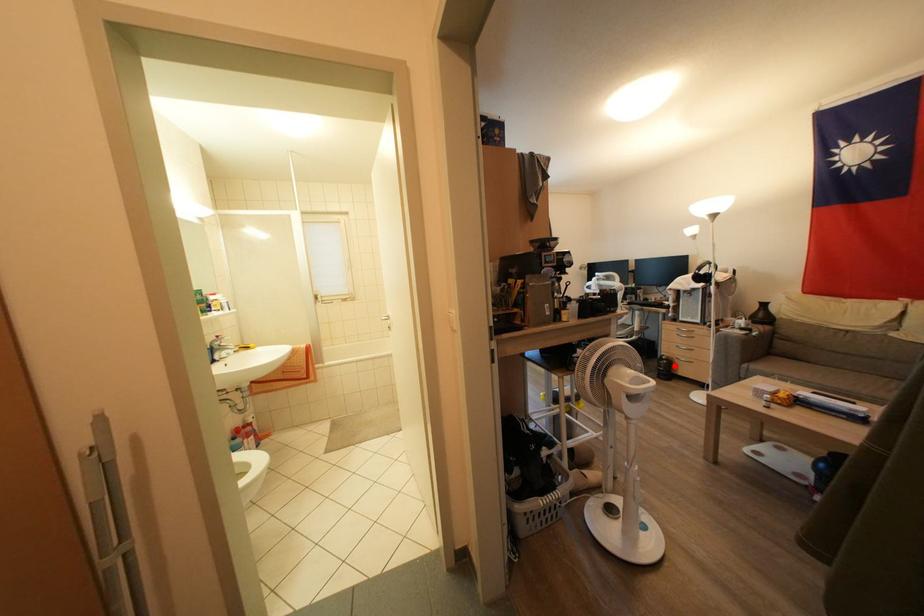
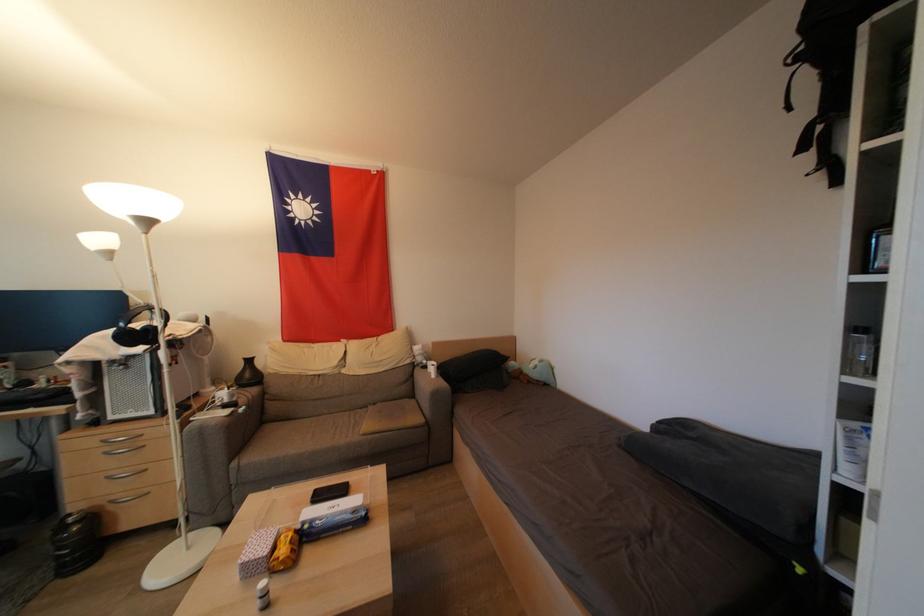
Locate, in the second image, the point that corresponds to the highlighted location in the first image.

(99, 521)